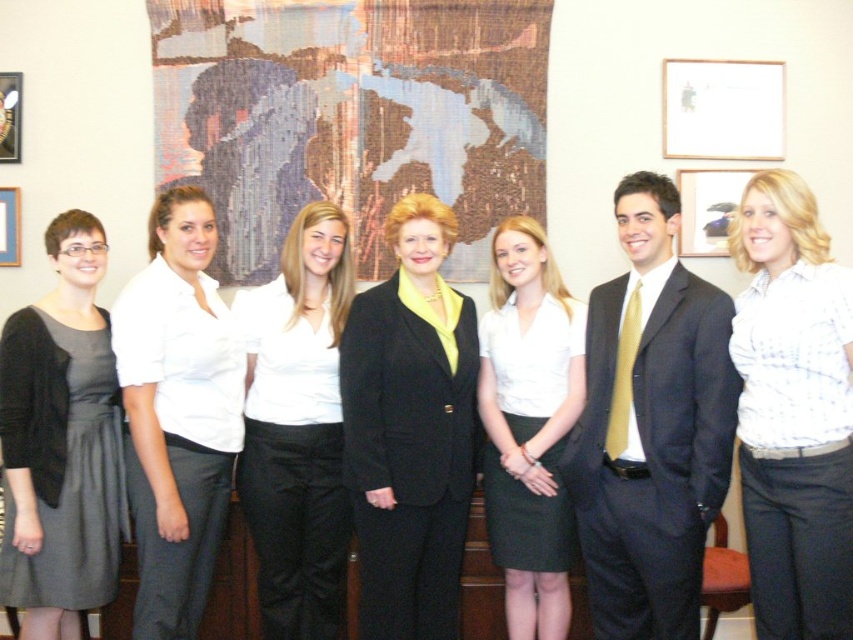
Does gray matte dress at left appear on the right side of wooden picture frame at upper right?

Incorrect, gray matte dress at left is not on the right side of wooden picture frame at upper right.

Who is more forward, (65, 483) or (732, 189)?

Point (65, 483) is more forward.

The image size is (853, 640). What are the coordinates of `gray matte dress at left` in the screenshot? It's located at click(x=62, y=461).

Is matte black suit at center positioned at the back of white paper at upper right?

No, it is in front of white paper at upper right.

Image resolution: width=853 pixels, height=640 pixels. Find the location of `matte black suit at center`. matte black suit at center is located at coordinates (651, 426).

Can you confirm if wooden picture frame at upper right is taller than brushed metal picture frame at upper left?

No, wooden picture frame at upper right is not taller than brushed metal picture frame at upper left.

Between wooden picture frame at upper right and brushed metal picture frame at upper left, which one appears on the right side from the viewer's perspective?

wooden picture frame at upper right is more to the right.

Who is more forward, [711,241] or [19,145]?

Point [19,145]

Find the location of `wooden picture frame at upper right`. wooden picture frame at upper right is located at coordinates (708, 209).